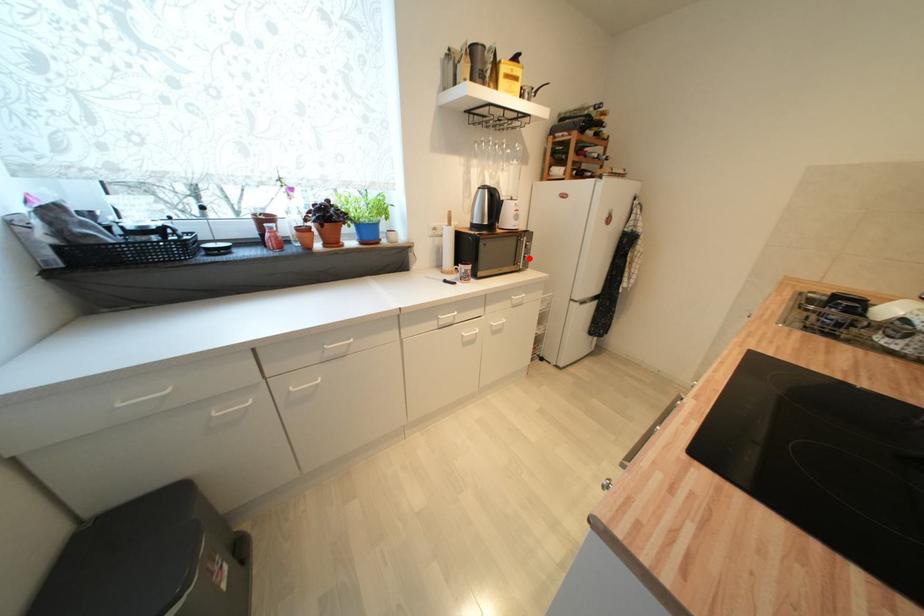
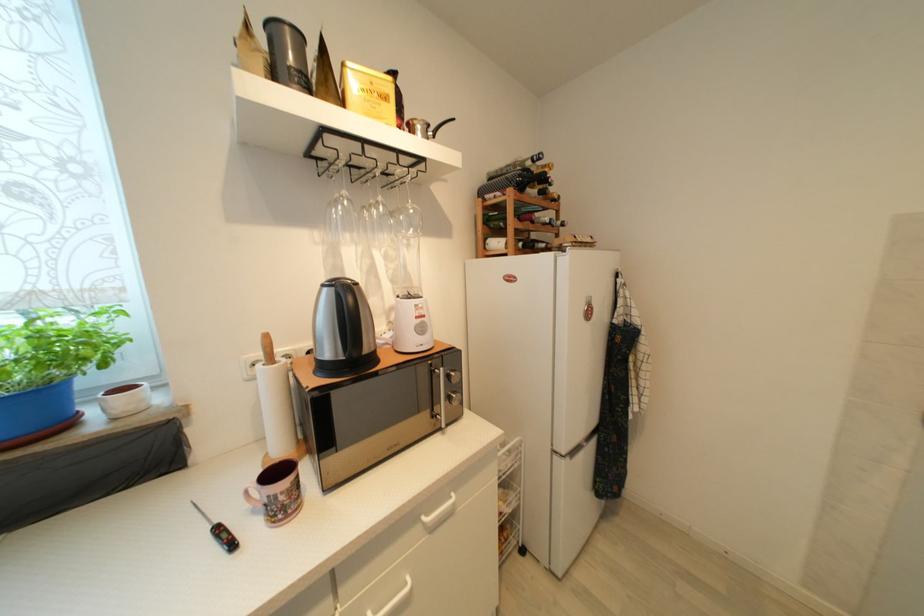
Question: I am providing you with two images of the same scene from different viewpoints. Image1 has a red point marked. In image2, the corresponding 3D location appears at what relative position? Reply with the corresponding letter.

Choices:
 (A) Closer
 (B) Farther

Answer: (B)